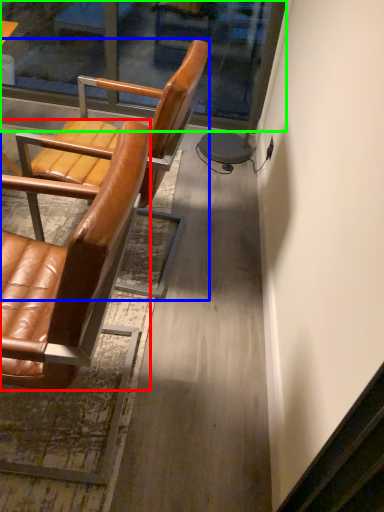
Question: Estimate the real-world distances between objects in this image. Which object is farther from chair (highlighted by a red box), chair (highlighted by a blue box) or glass door (highlighted by a green box)?

Choices:
 (A) chair
 (B) glass door

Answer: (B)